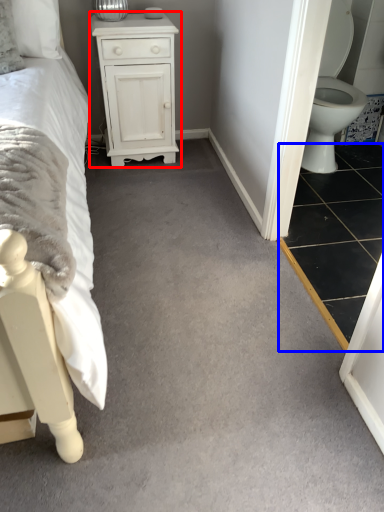
Question: Which of the following is the closest to the observer, chest of drawers (highlighted by a red box) or tile (highlighted by a blue box)?

Choices:
 (A) chest of drawers
 (B) tile

Answer: (B)